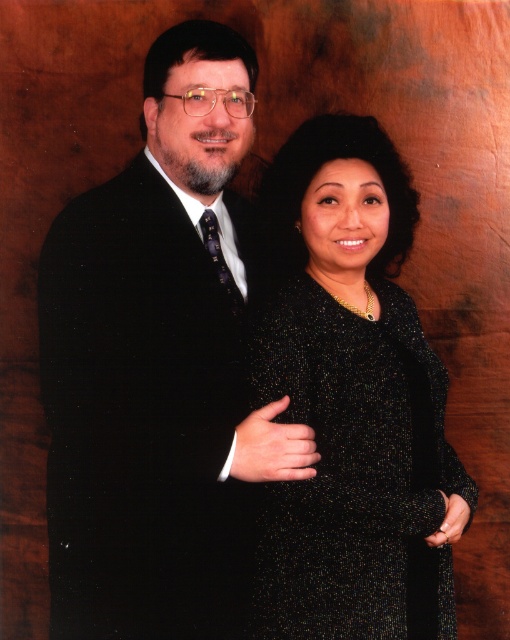
Based on the scene description, where is the satin black suit at left located in the image?

The satin black suit at left is located at point 0.573 on the x axis and 0.310 on the y axis.

You are a photographer setting up for a photoshoot. You notice the satin black suit at left and the sparkly black dress at center in the frame. Based on their positions, which object is closer to the left edge of the image?

The satin black suit at left is closer to the left edge of the image because it is positioned to the left of the sparkly black dress at center.